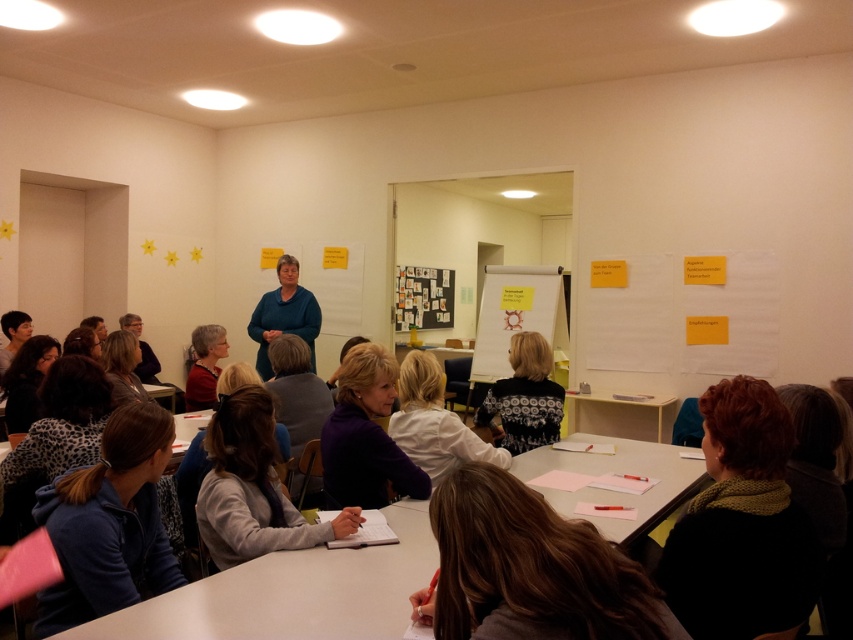
You are a photographer trying to capture a clear shot of the white matte shirt at center and the matte black hair at lower left. Since you want both subjects to appear equally prominent in the photo, which subject should you zoom in on more?

The white matte shirt at center is bigger than the matte black hair at lower left, so you should zoom in more on the matte black hair at lower left to make both subjects appear equally prominent.